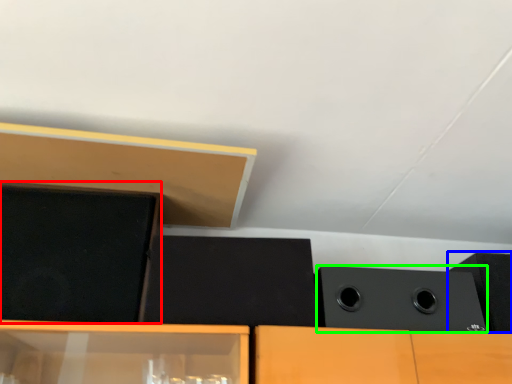
Question: Considering the real-world distances, which object is closest to speaker (highlighted by a red box)? speaker (highlighted by a blue box) or speaker (highlighted by a green box).

Choices:
 (A) speaker
 (B) speaker

Answer: (B)